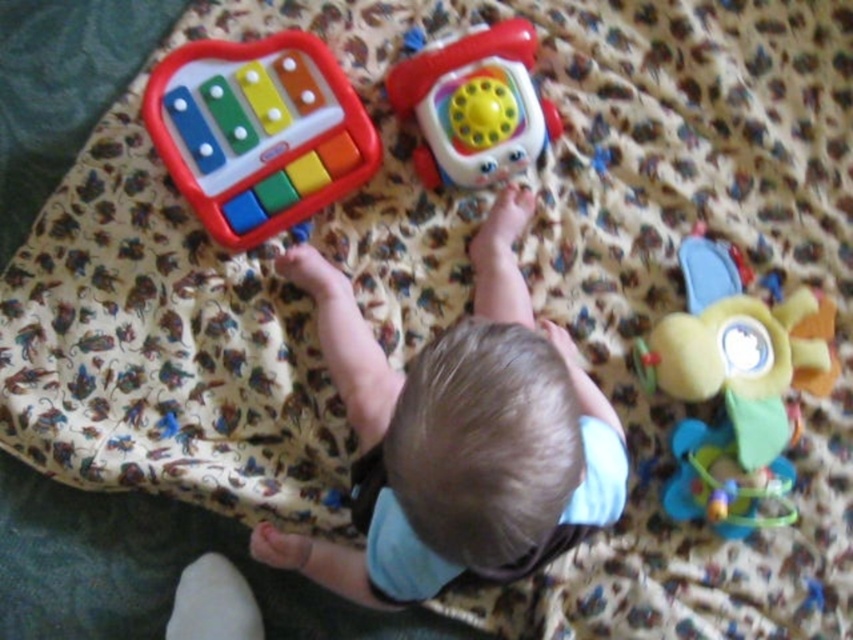
Looking at this image, you are a parent trying to give your baby the rubberized plastic phone at upper center. The baby is facing away from you. Can you reach the phone without moving the soft plush flower at upper center?

The soft plush flower at upper center is closer to the viewer than the rubberized plastic phone at upper center, so you would need to move the flower to access the phone.